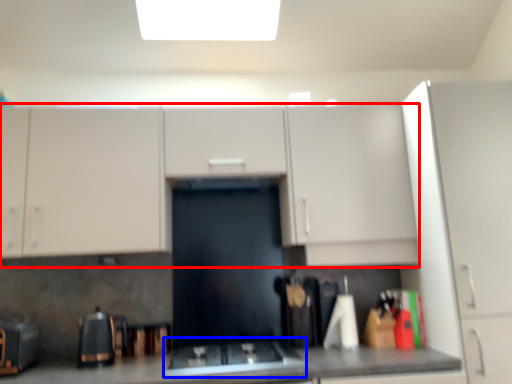
Question: Which of the following is the closest to the observer, cabinetry (highlighted by a red box) or gas stove (highlighted by a blue box)?

Choices:
 (A) cabinetry
 (B) gas stove

Answer: (B)